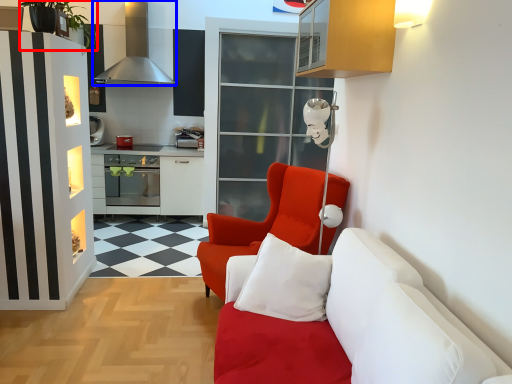
Question: Among these objects, which one is nearest to the camera, plant (highlighted by a red box) or exhaust hood (highlighted by a blue box)?

Choices:
 (A) plant
 (B) exhaust hood

Answer: (A)